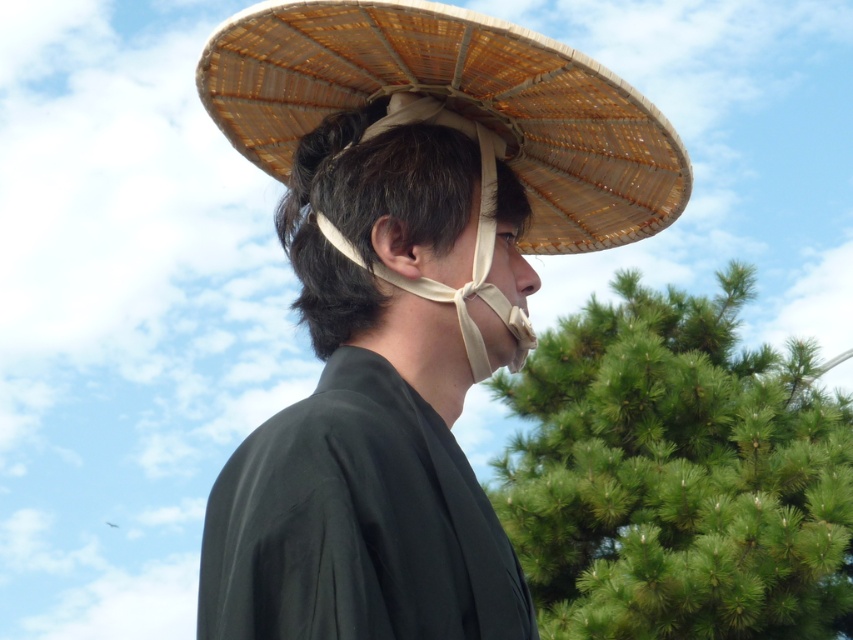
Does black silk kimono at center have a greater height compared to brown woven straw hat at upper center?

Indeed, black silk kimono at center has a greater height compared to brown woven straw hat at upper center.

Is black silk kimono at center bigger than brown woven straw hat at upper center?

No.

This screenshot has height=640, width=853. In order to click on black silk kimono at center in this screenshot , I will do `click(357, 524)`.

The image size is (853, 640). I want to click on black silk kimono at center, so click(357, 524).

Who is positioned more to the left, green needle-like leaves at right or black silk kimono at center?

black silk kimono at center

Is green needle-like leaves at right smaller than black silk kimono at center?

No.

Locate an element on the screen. green needle-like leaves at right is located at coordinates (677, 474).

Locate an element on the screen. This screenshot has height=640, width=853. green needle-like leaves at right is located at coordinates (677, 474).

Between green needle-like leaves at right and bamboo straw hat at center, which one appears on the right side from the viewer's perspective?

green needle-like leaves at right is more to the right.

Can you confirm if green needle-like leaves at right is positioned below bamboo straw hat at center?

Yes.

Is point (822, 580) positioned behind point (299, 298)?

Yes.

The image size is (853, 640). I want to click on green needle-like leaves at right, so click(x=677, y=474).